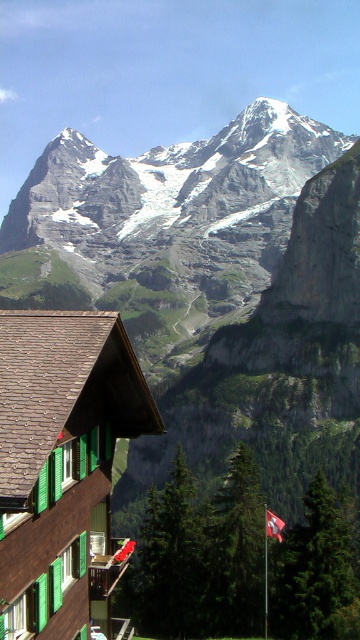
Question: In this image, where is brown shingle chalet at lower left located relative to red fabric flag at lower right?

Choices:
 (A) right
 (B) left

Answer: (B)

Question: Is snowy granite mountain range at upper center to the right of red fabric flag at lower right from the viewer's perspective?

Choices:
 (A) yes
 (B) no

Answer: (B)

Question: Which point is closer to the camera?

Choices:
 (A) red fabric flag at lower right
 (B) snowy granite mountain range at upper center

Answer: (A)

Question: Does snowy granite mountain range at upper center have a larger size compared to red fabric flag at lower right?

Choices:
 (A) no
 (B) yes

Answer: (B)

Question: Estimate the real-world distances between objects in this image. Which object is closer to the snowy granite mountain range at upper center?

Choices:
 (A) brown shingle chalet at lower left
 (B) red fabric flag at lower right

Answer: (A)

Question: Among these points, which one is farthest from the camera?

Choices:
 (A) tap(249, 224)
 (B) tap(270, 532)

Answer: (A)